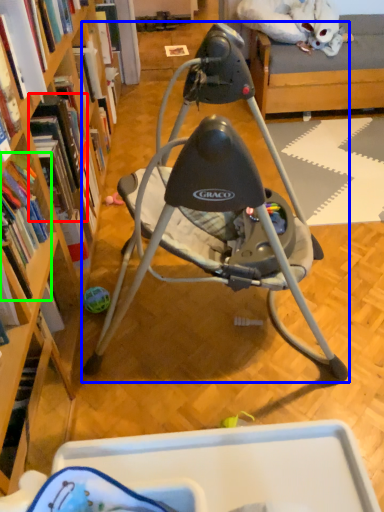
Question: Which is farther away from book (highlighted by a red box)? chair (highlighted by a blue box) or book (highlighted by a green box)?

Choices:
 (A) chair
 (B) book

Answer: (A)